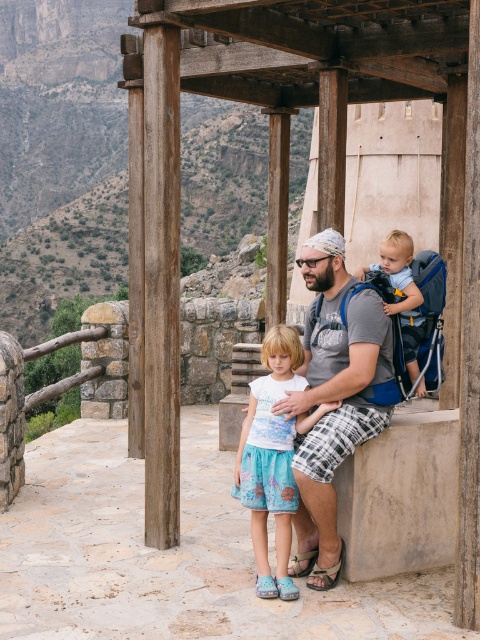
Question: From the image, what is the correct spatial relationship of light blue cotton skirt at center in relation to light blue fabric baby carrier at center?

Choices:
 (A) left
 (B) right

Answer: (A)

Question: In this image, where is wooden gazebo at center located relative to light blue fabric baby carrier at center?

Choices:
 (A) below
 (B) above

Answer: (B)

Question: Based on their relative distances, which object is nearer to the wooden gazebo at center?

Choices:
 (A) gray fabric shirt at center
 (B) light blue cotton skirt at center
 (C) light blue fabric baby carrier at center

Answer: (A)

Question: Is gray fabric shirt at center thinner than light blue cotton skirt at center?

Choices:
 (A) no
 (B) yes

Answer: (A)

Question: Estimate the real-world distances between objects in this image. Which object is farther from the gray fabric shirt at center?

Choices:
 (A) light blue fabric baby carrier at center
 (B) wooden gazebo at center
 (C) light blue cotton skirt at center

Answer: (B)

Question: Which point is closer to the camera?

Choices:
 (A) light blue cotton skirt at center
 (B) wooden gazebo at center
 (C) gray fabric shirt at center
 (D) light blue fabric baby carrier at center

Answer: (B)